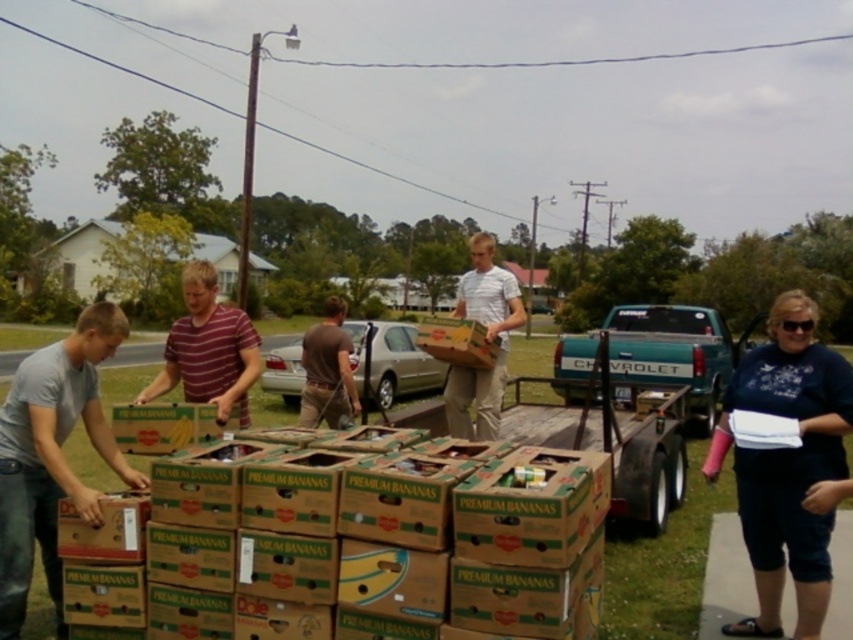
You are a volunteer at the food distribution event. You notice the gray matte shirt at left and the teal metallic truck at center. Which object is closer to you as you face the scene?

The gray matte shirt at left is closer to you because it is in front of the teal metallic truck at center.